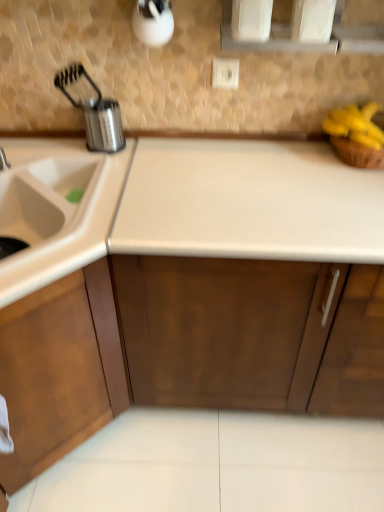
I want to click on free space in front of yellow matte bananas at upper right, so click(350, 182).